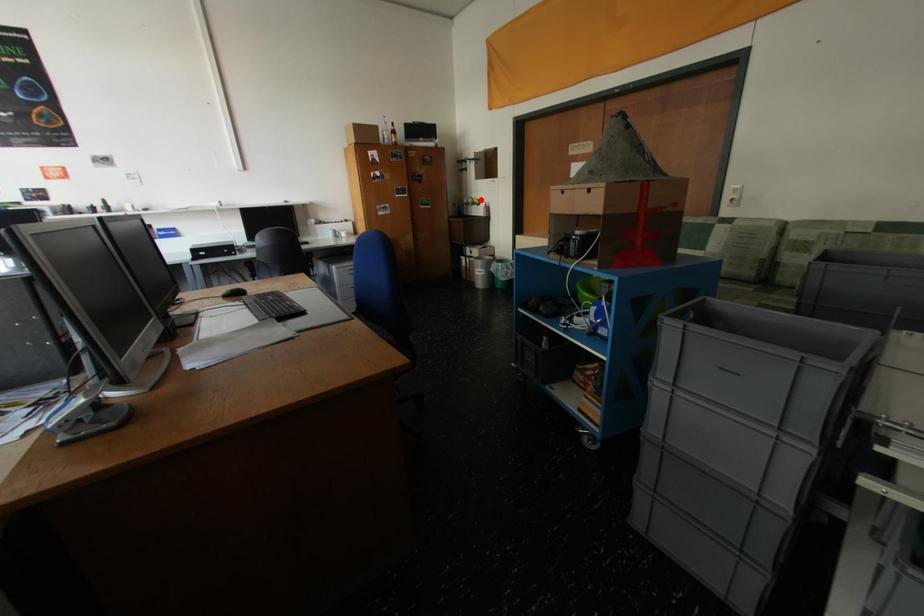
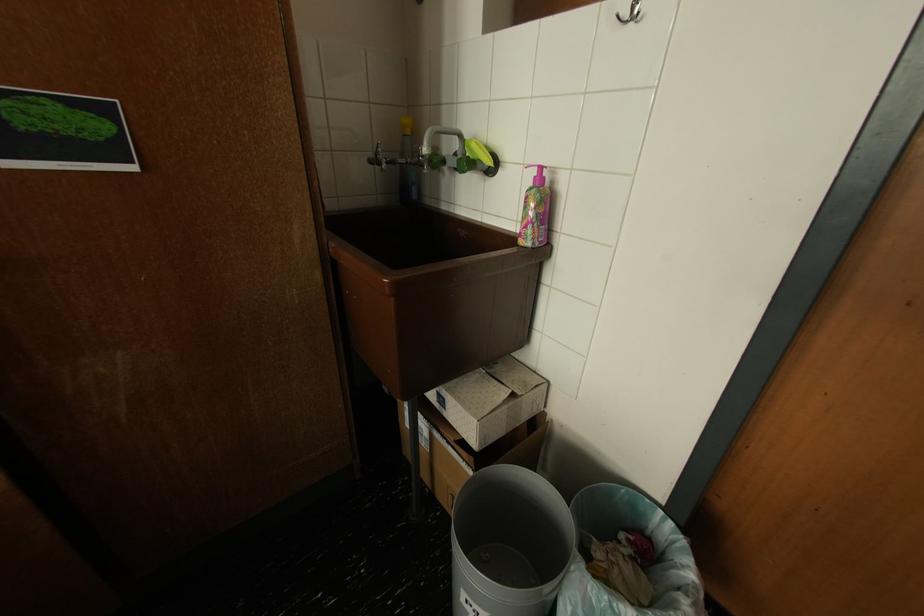
Locate, in the second image, the point that corresponds to the highlighted location in the first image.

(468, 138)